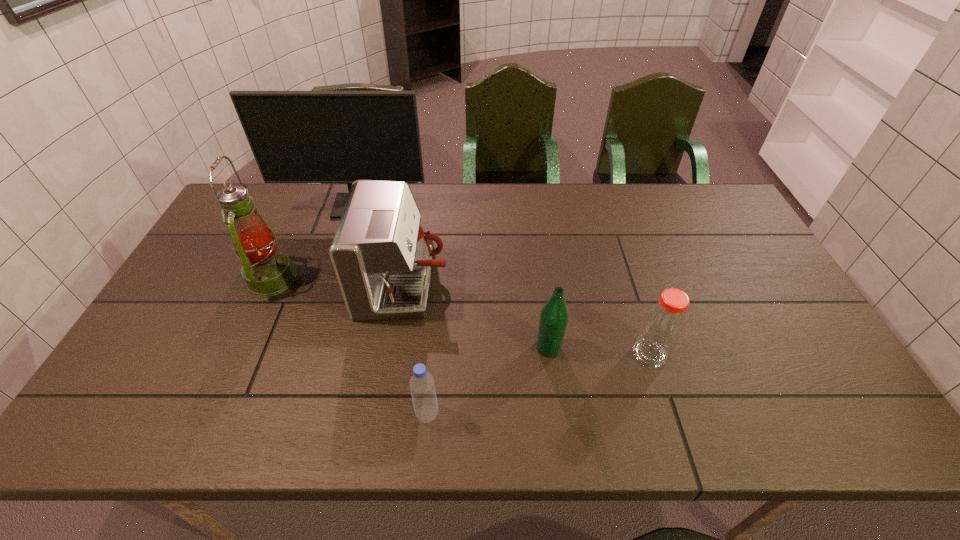
What are the coordinates of `free space between the computer monitor and the rightmost object` in the screenshot? It's located at (502, 281).

Image resolution: width=960 pixels, height=540 pixels. I want to click on free point between the rightmost object and the shortest bottle, so click(x=539, y=384).

At what (x,y) coordinates should I click in order to perform the action: click on free point between the fourth shortest object and the nearest bottle. Please return your answer as a coordinate pair (x, y). Looking at the image, I should click on (416, 350).

Where is `vacant space that's between the farthest object and the oil lamp`? This screenshot has width=960, height=540. vacant space that's between the farthest object and the oil lamp is located at coordinates (314, 244).

I want to click on vacant space in between the rightmost object and the second bottle from left to right, so click(599, 351).

Where is `object that can be found as the fourth closest to the shortest bottle`? object that can be found as the fourth closest to the shortest bottle is located at coordinates (267, 272).

Locate an element on the screen. Image resolution: width=960 pixels, height=540 pixels. object that is the fifth nearest to the oil lamp is located at coordinates (663, 324).

This screenshot has width=960, height=540. What are the coordinates of `the second closest bottle relative to the computer monitor` in the screenshot? It's located at (422, 386).

Image resolution: width=960 pixels, height=540 pixels. Find the location of `bottle object that ranks as the closest to the nearest bottle`. bottle object that ranks as the closest to the nearest bottle is located at coordinates (554, 315).

The width and height of the screenshot is (960, 540). In order to click on vacant space that satisfies the following two spatial constraints: 1. on the front-facing side of the farthest object; 2. on the right side of the second bottle from right to left in this screenshot , I will do `click(310, 348)`.